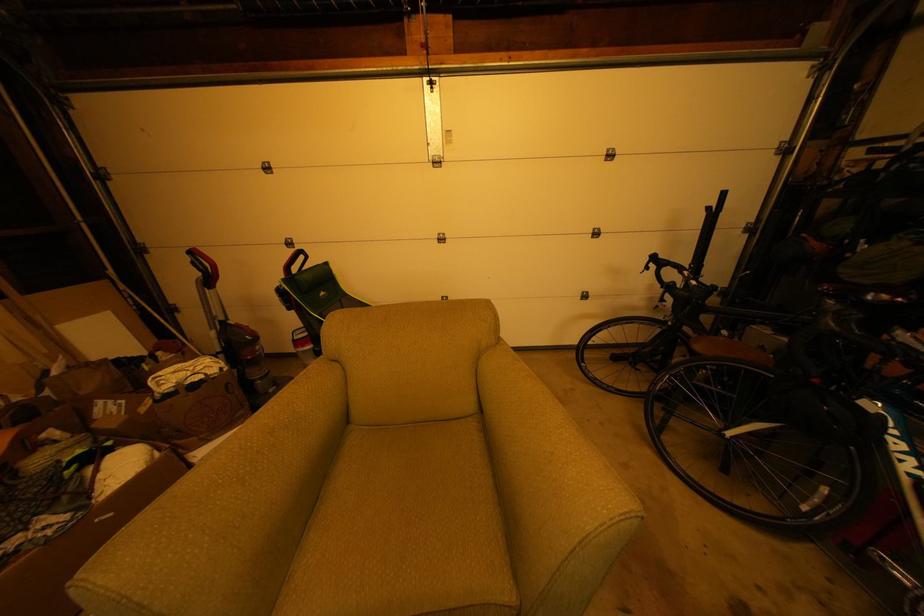
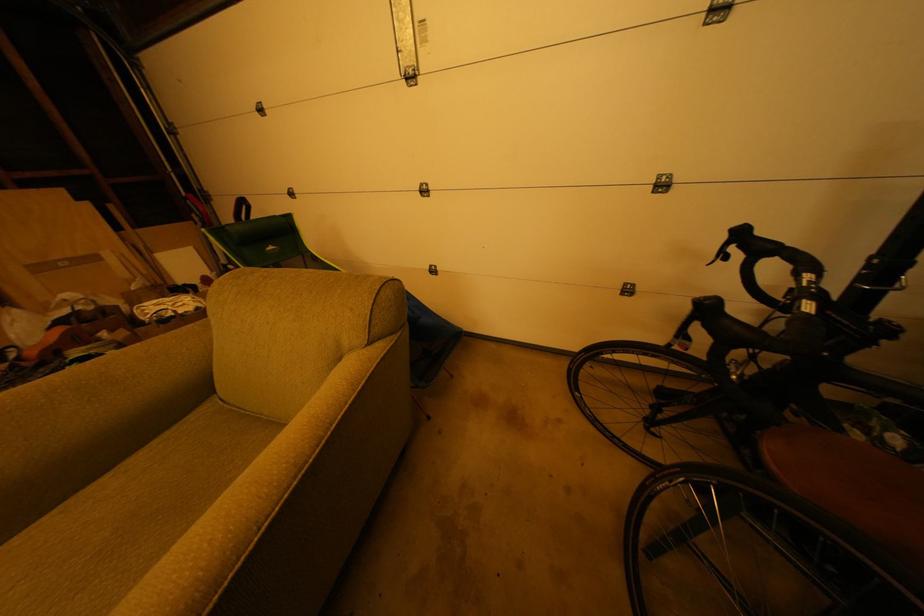
The images are taken continuously from a first-person perspective. In which direction are you moving?

The movement direction of the cameraman is right, forward.